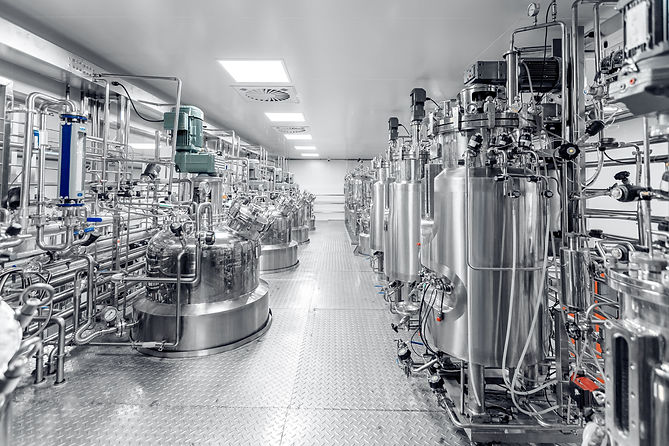
This screenshot has height=446, width=669. Find the location of `ceiling`. ceiling is located at coordinates pos(355,35).